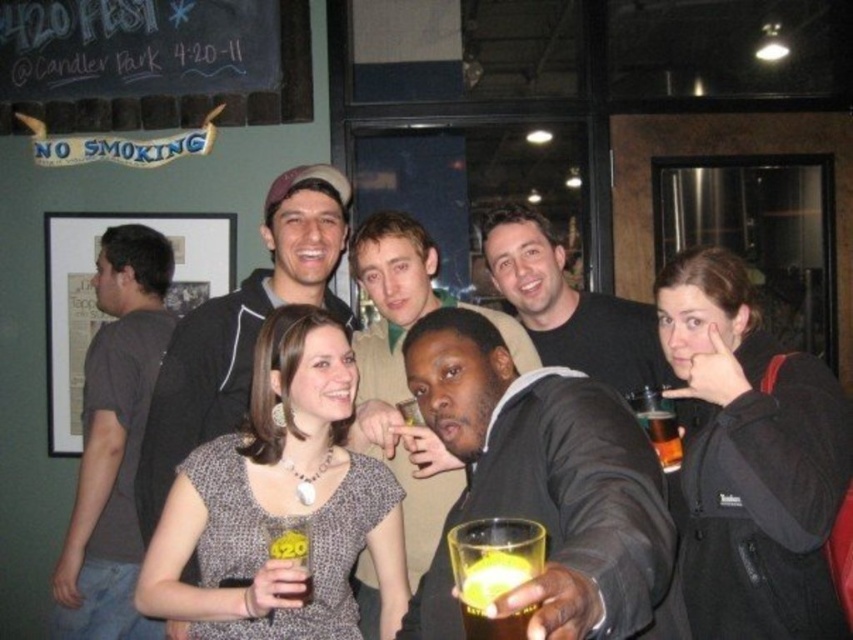
Is point (606, 579) more distant than point (486, 614)?

That is True.

Does smooth black suit at center lie in front of translucent yellow liquid at lower center?

Yes.

Which is in front, point (412, 385) or point (462, 588)?

Positioned in front is point (462, 588).

This screenshot has width=853, height=640. I want to click on smooth black suit at center, so click(x=544, y=486).

Does gray cotton t-shirt at left have a lesser width compared to matte black hoodie at upper center?

Correct, gray cotton t-shirt at left's width is less than matte black hoodie at upper center's.

Who is positioned more to the right, gray cotton t-shirt at left or matte black hoodie at upper center?

matte black hoodie at upper center is more to the right.

Which is in front, point (88, 506) or point (231, 371)?

Point (231, 371) is more forward.

Image resolution: width=853 pixels, height=640 pixels. I want to click on gray cotton t-shirt at left, so click(114, 440).

Based on the photo, who is shorter, smooth black jacket at center or translucent plastic cup at lower right?

Standing shorter between the two is translucent plastic cup at lower right.

Which is more to the right, smooth black jacket at center or translucent plastic cup at lower right?

From the viewer's perspective, translucent plastic cup at lower right appears more on the right side.

Is point (393, 420) more distant than point (674, 416)?

Yes, it is.

Where is `smooth black jacket at center`? The image size is (853, 640). smooth black jacket at center is located at coordinates (404, 372).